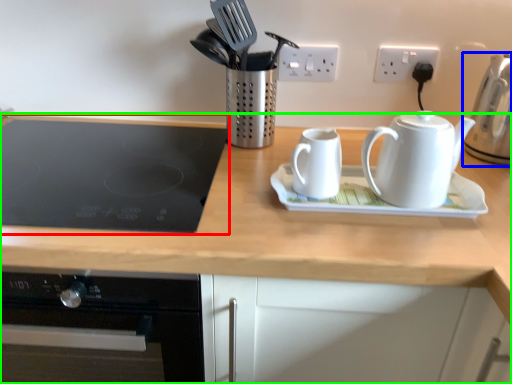
Question: Which object is the farthest from gas stove (highlighted by a red box)? Choose among these: kettle (highlighted by a blue box) or countertop (highlighted by a green box).

Choices:
 (A) kettle
 (B) countertop

Answer: (A)